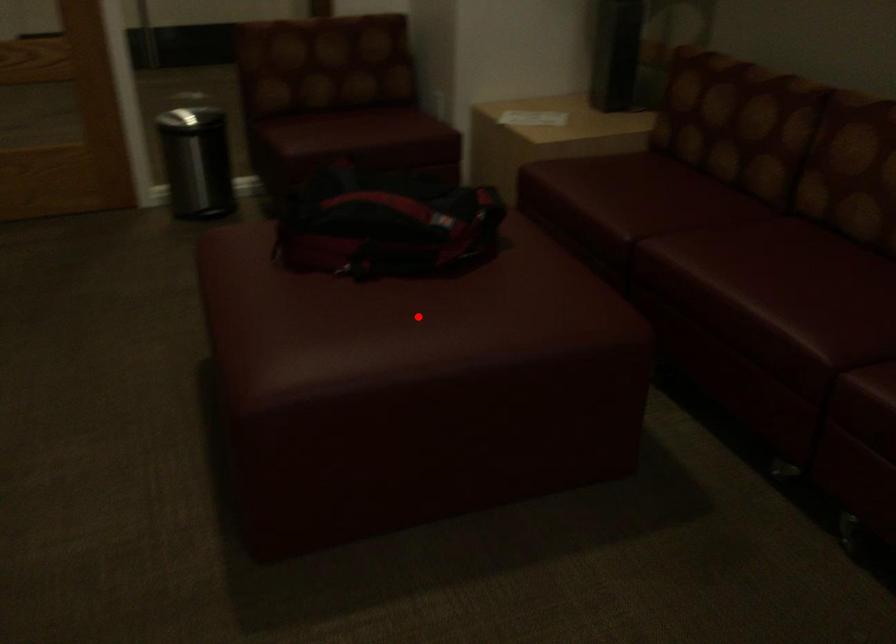
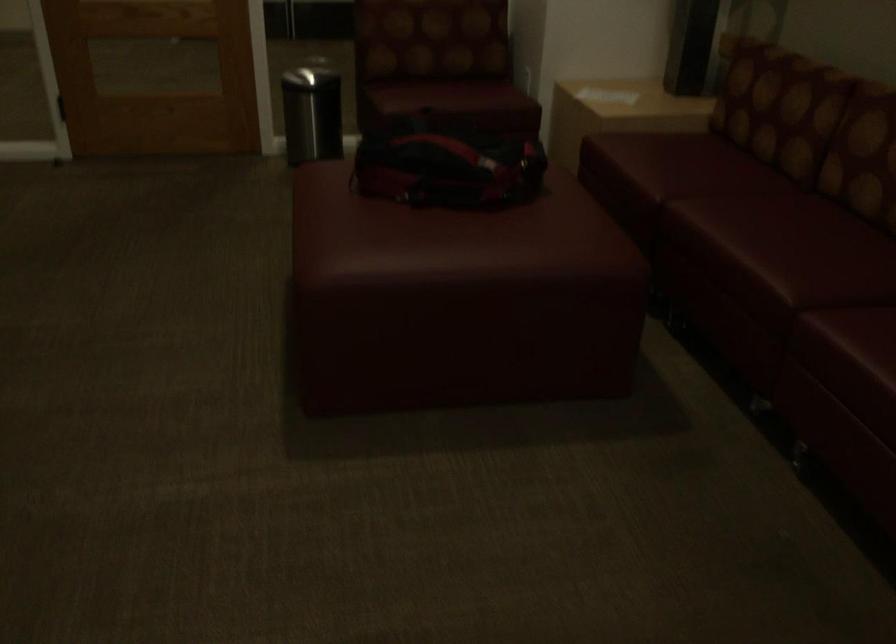
Question: I am providing you with two images of the same scene from different viewpoints. A red point is shown in image1. For the corresponding object point in image2, is it positioned nearer or farther from the camera?

Choices:
 (A) Nearer
 (B) Farther

Answer: (B)